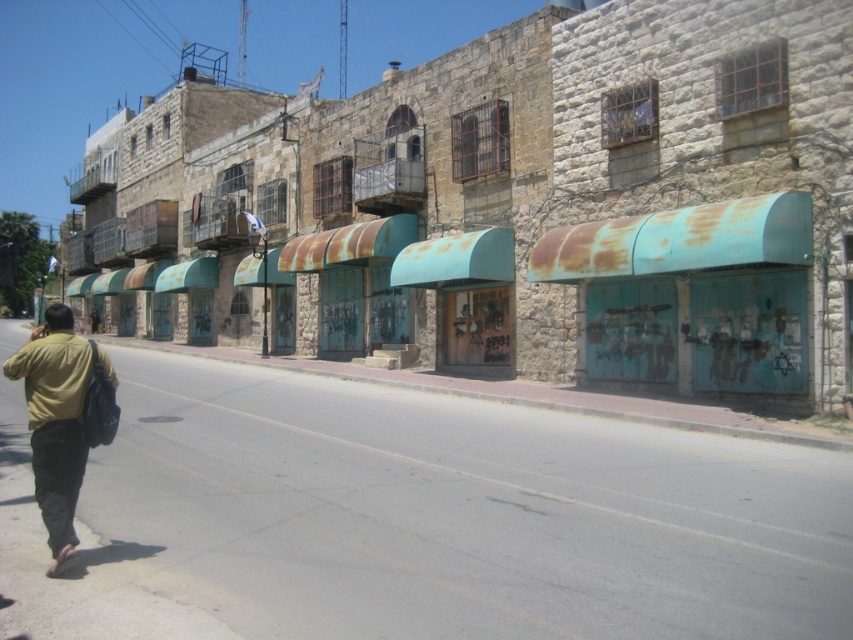
Is yellow matte jacket at lower left above dark brown leather jacket at lower left?

Result: Actually, yellow matte jacket at lower left is below dark brown leather jacket at lower left.

Which is above, yellow matte jacket at lower left or dark brown leather jacket at lower left?

Positioned higher is dark brown leather jacket at lower left.

Which is behind, point (102, 356) or point (97, 312)?

The point (97, 312) is more distant.

The height and width of the screenshot is (640, 853). Identify the location of yellow matte jacket at lower left. (51, 376).

Who is positioned more to the left, matte yellow shirt at lower left or dark brown leather jacket at lower left?

From the viewer's perspective, dark brown leather jacket at lower left appears more on the left side.

Is point (36, 406) less distant than point (97, 330)?

Yes, it is.

Is point (71, 364) closer to viewer compared to point (91, 326)?

Yes, point (71, 364) is in front of point (91, 326).

Where is `matte yellow shirt at lower left`? This screenshot has width=853, height=640. matte yellow shirt at lower left is located at coordinates (57, 420).

Does matte yellow shirt at lower left appear on the right side of yellow matte jacket at lower left?

Indeed, matte yellow shirt at lower left is positioned on the right side of yellow matte jacket at lower left.

Who is more distant from viewer, [74,380] or [76,352]?

The point [76,352] is behind.

Identify the location of matte yellow shirt at lower left. (57, 420).